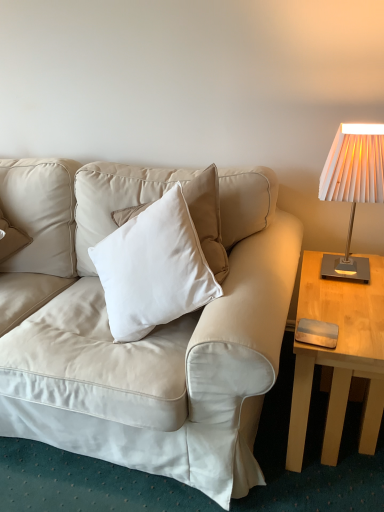
The height and width of the screenshot is (512, 384). What are the coordinates of `free space to the right of metallic silver pad at right` in the screenshot? It's located at (365, 326).